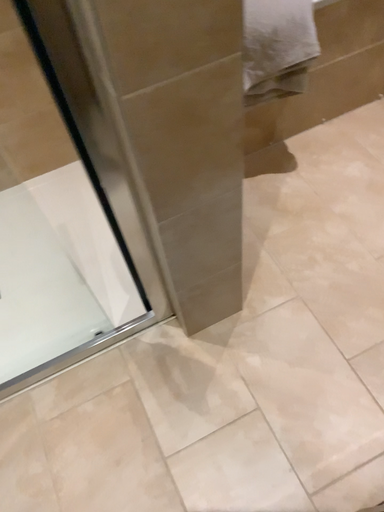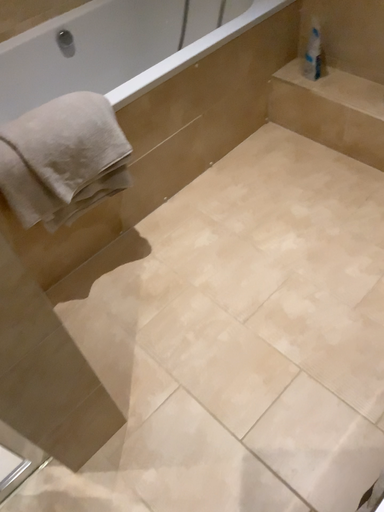
Question: How did the camera likely rotate when shooting the video?

Choices:
 (A) rotated upward
 (B) rotated downward

Answer: (A)